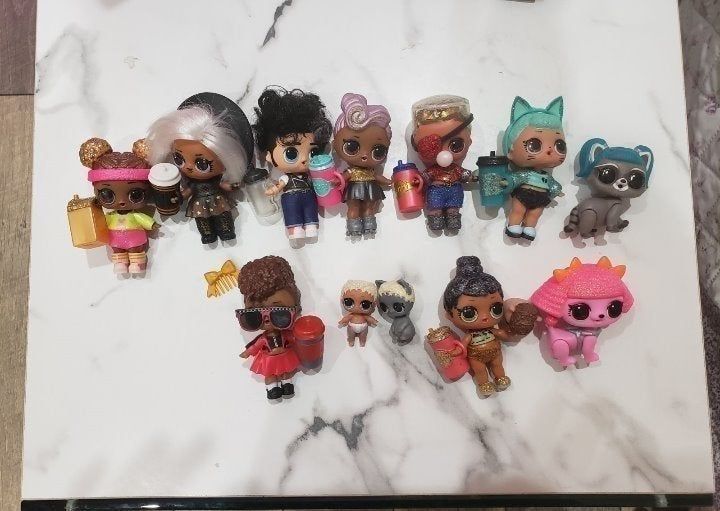
In order to click on plastic fake cups in this screenshot , I will do `click(333, 180)`, `click(407, 195)`, `click(445, 358)`, `click(301, 360)`, `click(94, 224)`, `click(168, 200)`, `click(497, 176)`, `click(260, 200)`.